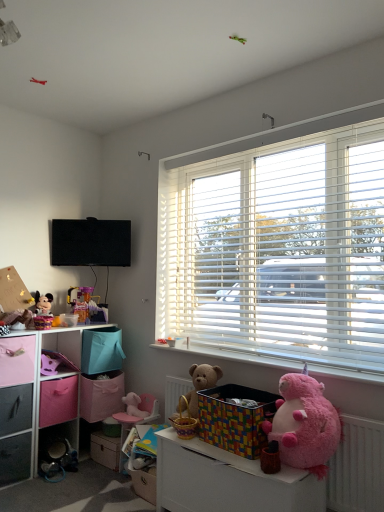
The height and width of the screenshot is (512, 384). Find the location of `white matte shelf at lower center`. white matte shelf at lower center is located at coordinates (228, 481).

I want to click on soft brown teddy bear at center, arranged as the 1th teddy bear when viewed from the back, so click(198, 387).

Measure the distance between metallic gray drawer at lower left, the 2th drawer positioned from the right, and camera.

metallic gray drawer at lower left, the 2th drawer positioned from the right, and camera are 2.43 meters apart from each other.

Locate an element on the screen. Image resolution: width=384 pixels, height=512 pixels. metallic gray drawer at lower left, the 2th drawer positioned from the right is located at coordinates (16, 408).

Locate an element on the screen. The height and width of the screenshot is (512, 384). matte pink fabric storage unit at left is located at coordinates (27, 397).

This screenshot has height=512, width=384. What do you see at coordinates (358, 467) in the screenshot? I see `white plastic radiator at lower right` at bounding box center [358, 467].

Where is `white plastic window sill at lower center`? The height and width of the screenshot is (512, 384). white plastic window sill at lower center is located at coordinates (234, 354).

Which is correct: pink fabric storage box at left, placed as the second storage box when sorted from front to back, is inside white blinds at center, or outside of it?

pink fabric storage box at left, placed as the second storage box when sorted from front to back, is spatially situated outside white blinds at center.

Where is `window above the pink fabric storage box at left, which is counted as the second storage box, starting from the right (from a real-world perspective)`? This screenshot has width=384, height=512. window above the pink fabric storage box at left, which is counted as the second storage box, starting from the right (from a real-world perspective) is located at coordinates (279, 246).

Is pink fabric storage box at left, which is counted as the second storage box, starting from the right, far from white blinds at center?

Yes, pink fabric storage box at left, which is counted as the second storage box, starting from the right, and white blinds at center are quite far apart.

Is pink plush toy at lower left, arranged as the 3th toy when viewed from the top, aimed at brushed metal drawer at lower left, arranged as the 1th drawer when viewed from the left?

No, pink plush toy at lower left, arranged as the 3th toy when viewed from the top, is not turned towards brushed metal drawer at lower left, arranged as the 1th drawer when viewed from the left.

Is pink plush toy at lower left, the 3th toy from the left, taller or shorter than brushed metal drawer at lower left, arranged as the 1th drawer when viewed from the left?

In the image, pink plush toy at lower left, the 3th toy from the left, appears to be shorter than brushed metal drawer at lower left, arranged as the 1th drawer when viewed from the left.

Which object is closer to the camera taking this photo, pink plush toy at lower left, the 3th toy from the left, or brushed metal drawer at lower left, arranged as the 1th drawer when viewed from the left?

brushed metal drawer at lower left, arranged as the 1th drawer when viewed from the left, is in front.

Are pink plush toy at lower left, arranged as the 3th toy when viewed from the top, and brushed metal drawer at lower left, arranged as the 1th drawer when viewed from the left, far apart?

That's not correct — pink plush toy at lower left, arranged as the 3th toy when viewed from the top, is a little close to brushed metal drawer at lower left, arranged as the 1th drawer when viewed from the left.

Is white plastic radiator at lower right to the right of pink fabric basket at lower left, which is counted as the second toy, starting from the left, from the viewer's perspective?

Indeed, white plastic radiator at lower right is positioned on the right side of pink fabric basket at lower left, which is counted as the second toy, starting from the left.

Is white plastic radiator at lower right not within pink fabric basket at lower left, which is the 2th toy in top-to-bottom order?

white plastic radiator at lower right is positioned outside pink fabric basket at lower left, which is the 2th toy in top-to-bottom order.

How much distance is there between white plastic radiator at lower right and pink fabric basket at lower left, which is the 2th toy in top-to-bottom order?

A distance of 1.80 meters exists between white plastic radiator at lower right and pink fabric basket at lower left, which is the 2th toy in top-to-bottom order.

Which of these two, white plastic radiator at lower right or pink fabric basket at lower left, marked as the second toy in a right-to-left arrangement, is smaller?

pink fabric basket at lower left, marked as the second toy in a right-to-left arrangement.

Can you tell me how much matte pink fabric storage unit at left and cardboard box at lower left, placed as the first cardboard box when sorted from right to left, differ in facing direction?

They differ by 0.000336 degrees in their facing directions.

From the image's perspective, does matte pink fabric storage unit at left appear lower than cardboard box at lower left, which is the second cardboard box from left to right?

No, from the image's perspective, matte pink fabric storage unit at left is not beneath cardboard box at lower left, which is the second cardboard box from left to right.

Which is behind, matte pink fabric storage unit at left or cardboard box at lower left, which is the second cardboard box from left to right?

Positioned behind is cardboard box at lower left, which is the second cardboard box from left to right.

Looking at this image, does matte pink fabric storage unit at left have a greater height compared to cardboard box at lower left, placed as the first cardboard box when sorted from right to left?

Yes, matte pink fabric storage unit at left is taller than cardboard box at lower left, placed as the first cardboard box when sorted from right to left.

Would you say fuzzy pink teddy bear at lower right, which ranks as the 2th teddy bear in back-to-front order, is inside or outside multicolored woven storage box at center, marked as the 1th storage box in a front-to-back arrangement?

fuzzy pink teddy bear at lower right, which ranks as the 2th teddy bear in back-to-front order, is outside multicolored woven storage box at center, marked as the 1th storage box in a front-to-back arrangement.

Does point (331, 438) appear closer or farther from the camera than point (212, 409)?

Point (331, 438) is positioned closer to the camera compared to point (212, 409).

This screenshot has height=512, width=384. I want to click on the 2nd teddy bear positioned above the multicolored woven storage box at center, which ranks as the first storage box in right-to-left order (from a real-world perspective), so click(304, 424).

From a real-world perspective, which object rests below the other?

multicolored woven storage box at center, marked as the 2th storage box in a left-to-right arrangement, is physically lower.

From a real-world perspective, is metallic gray drawer at lower left, the second drawer positioned from the left, physically located above or below white matte shelf at lower center?

metallic gray drawer at lower left, the second drawer positioned from the left, is situated higher than white matte shelf at lower center in the real world.

Who is more distant, metallic gray drawer at lower left, the second drawer positioned from the left, or white matte shelf at lower center?

Positioned behind is metallic gray drawer at lower left, the second drawer positioned from the left.

Measure the distance from metallic gray drawer at lower left, the second drawer positioned from the left, to white matte shelf at lower center.

A distance of 3.86 feet exists between metallic gray drawer at lower left, the second drawer positioned from the left, and white matte shelf at lower center.

Would you say metallic gray drawer at lower left, the 2th drawer positioned from the right, is outside white matte shelf at lower center?

Yes, metallic gray drawer at lower left, the 2th drawer positioned from the right, is outside of white matte shelf at lower center.

How distant is matte gray drawer at lower left, which is the 3th drawer in left-to-right order, from cardboard box at lower left, which is the second cardboard box from left to right?

matte gray drawer at lower left, which is the 3th drawer in left-to-right order, is 23.81 centimeters from cardboard box at lower left, which is the second cardboard box from left to right.

Based on their positions, is matte gray drawer at lower left, positioned as the 1th drawer in right-to-left order, located to the left or right of cardboard box at lower left, placed as the first cardboard box when sorted from right to left?

matte gray drawer at lower left, positioned as the 1th drawer in right-to-left order, is to the right of cardboard box at lower left, placed as the first cardboard box when sorted from right to left.

Does point (101, 444) come behind point (93, 401)?

No.

Is matte gray drawer at lower left, which is the 3th drawer in left-to-right order, in front of cardboard box at lower left, which is the second cardboard box from left to right?

Yes, matte gray drawer at lower left, which is the 3th drawer in left-to-right order, is closer to the viewer.

This screenshot has height=512, width=384. What are the coordinates of `window above the pink fabric storage box at left, placed as the second storage box when sorted from front to back (from the image's perspective)` in the screenshot? It's located at (279, 246).

Where is `toy that is the 2nd one when counting backward from the brushed metal drawer at lower left, which is the 3th drawer in right-to-left order`? The height and width of the screenshot is (512, 384). toy that is the 2nd one when counting backward from the brushed metal drawer at lower left, which is the 3th drawer in right-to-left order is located at coordinates (136, 405).

Consider the image. Looking at the image, which one is located further to matte pink plush at left, which is the first toy from left to right, white plastic window sill at lower center or black matte television at upper left?

white plastic window sill at lower center is further to matte pink plush at left, which is the first toy from left to right.

Looking at the image, which one is located further to white matte shelf at lower center, white blinds at center or pink cardboard box at lower left, the 1th cardboard box when ordered from left to right?

pink cardboard box at lower left, the 1th cardboard box when ordered from left to right.

Looking at the image, which one is located closer to metallic gray drawer at lower left, the second drawer positioned from the left, white blinds at center or white matte shelf at lower center?

white matte shelf at lower center is closer to metallic gray drawer at lower left, the second drawer positioned from the left.

Estimate the real-world distances between objects in this image. Which object is further from white plastic window sill at lower center, matte pink plush at left, the third toy ordered from the bottom, or multicolored woven storage box at center, marked as the 1th storage box in a front-to-back arrangement?

matte pink plush at left, the third toy ordered from the bottom, is further to white plastic window sill at lower center.

Which object lies nearer to the anchor point matte gray drawer at lower left, positioned as the 1th drawer in right-to-left order, pink fabric storage box at left, which is the first storage box in left-to-right order, or matte pink fabric storage unit at left?

matte pink fabric storage unit at left is positioned closer to the anchor matte gray drawer at lower left, positioned as the 1th drawer in right-to-left order.

Considering their positions, is white matte shelf at lower center positioned further to pink fabric storage box at left, placed as the second storage box when sorted from front to back, than matte gray drawer at lower left, positioned as the 1th drawer in right-to-left order?

white matte shelf at lower center lies further to pink fabric storage box at left, placed as the second storage box when sorted from front to back, than the other object.

From the image, which object appears to be farther from white blinds at center, matte pink plush at left, which is the first toy in top-to-bottom order, or white plastic window sill at lower center?

Based on the image, matte pink plush at left, which is the first toy in top-to-bottom order, appears to be further to white blinds at center.

Based on the photo, when comparing their distances from white blinds at center, does cardboard box at lower left, which is the second cardboard box from left to right, or white plastic window sill at lower center seem further?

Among the two, cardboard box at lower left, which is the second cardboard box from left to right, is located further to white blinds at center.

Locate an element on the screen. The image size is (384, 512). shelf between pink cardboard box at lower left, which is counted as the 2th cardboard box, starting from the right, and white blinds at center, in the horizontal direction is located at coordinates (228, 481).

The width and height of the screenshot is (384, 512). Find the location of `cardboard box located between pink cardboard box at lower left, which is counted as the 2th cardboard box, starting from the right, and white plastic window sill at lower center in the left-right direction`. cardboard box located between pink cardboard box at lower left, which is counted as the 2th cardboard box, starting from the right, and white plastic window sill at lower center in the left-right direction is located at coordinates (101, 396).

This screenshot has width=384, height=512. I want to click on teddy bear between pink cardboard box at lower left, the 1th cardboard box when ordered from left to right, and white plastic window sill at lower center, in the horizontal direction, so click(x=198, y=387).

At what (x,y) coordinates should I click in order to perform the action: click on window sill between white matte shelf at lower center and matte gray drawer at lower left, positioned as the 1th drawer in right-to-left order, from front to back. Please return your answer as a coordinate pair (x, y). Looking at the image, I should click on (234, 354).